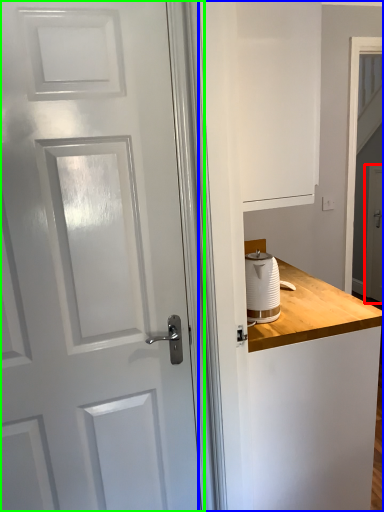
Question: Which is nearer to the screen door (highlighted by a red box)? dresser (highlighted by a blue box) or door (highlighted by a green box).

Choices:
 (A) dresser
 (B) door

Answer: (A)